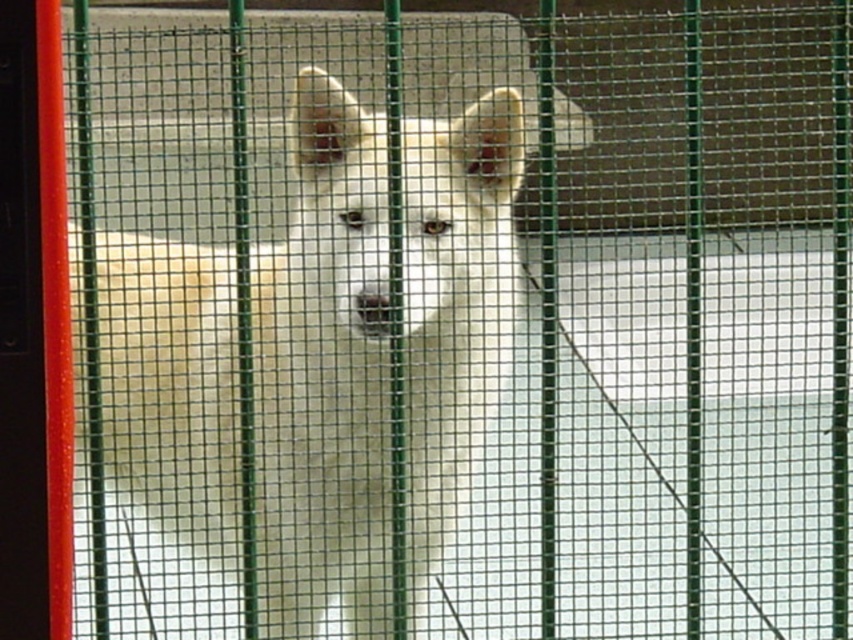
Consider the image. Does white fur dog at center have a greater height compared to red plastic screen door at left?

Yes.

Consider the image. Can you confirm if white fur dog at center is bigger than red plastic screen door at left?

Indeed, white fur dog at center has a larger size compared to red plastic screen door at left.

Which is in front, point (466, 408) or point (10, 88)?

Point (10, 88) is more forward.

At what (x,y) coordinates should I click in order to perform the action: click on white fur dog at center. Please return your answer as a coordinate pair (x, y). Looking at the image, I should click on (323, 376).